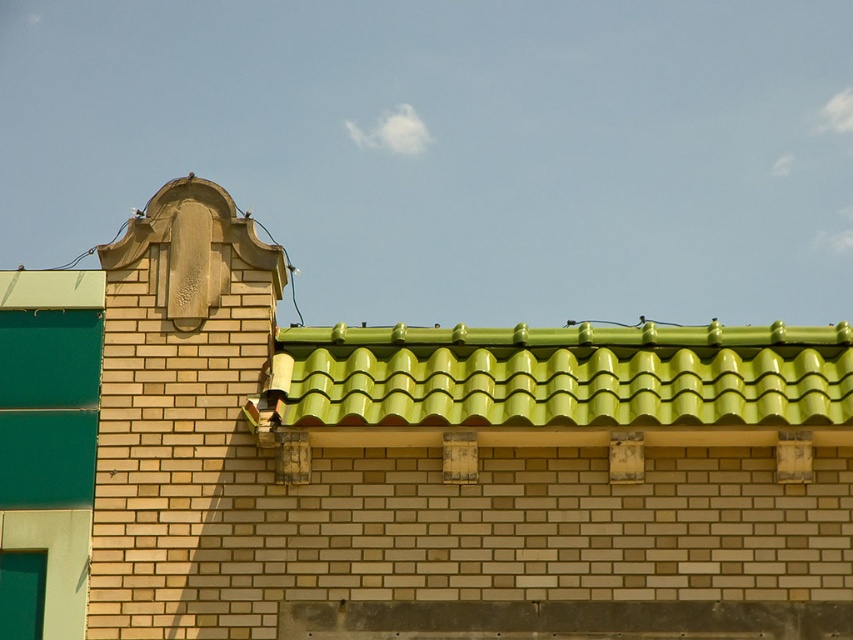
Does green glazed tiles at upper center lie behind green glossy tiles at upper center?

No, it is not.

Is point (599, 452) positioned behind point (680, 376)?

No, it is in front of (680, 376).

At what (x,y) coordinates should I click in order to perform the action: click on green glazed tiles at upper center. Please return your answer as a coordinate pair (x, y). Looking at the image, I should click on (450, 461).